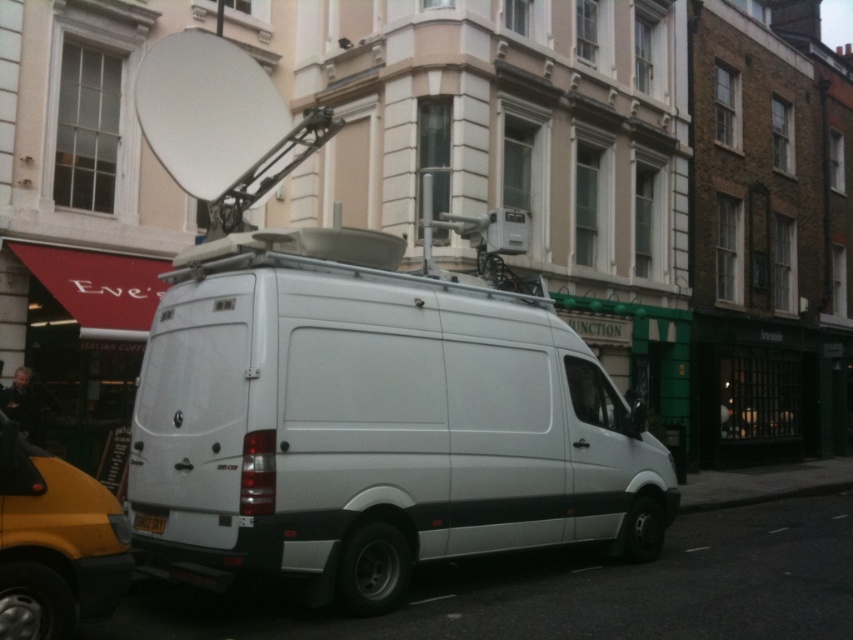
Question: Is white matte van at center in front of black plastic license plate at rear?

Choices:
 (A) no
 (B) yes

Answer: (B)

Question: Does white matte van at center come behind black plastic license plate at rear?

Choices:
 (A) no
 (B) yes

Answer: (A)

Question: Does white matte van at center lie in front of black plastic license plate at rear?

Choices:
 (A) yes
 (B) no

Answer: (A)